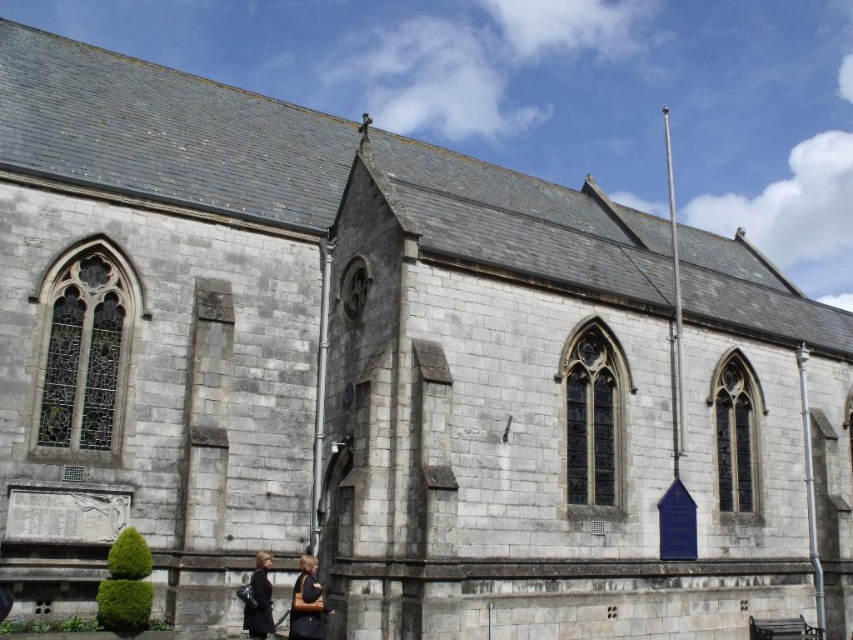
Does dark brown leather jacket at lower center appear on the right side of dark gray coat at lower center?

Correct, you'll find dark brown leather jacket at lower center to the right of dark gray coat at lower center.

Which is more to the left, dark brown leather jacket at lower center or dark gray coat at lower center?

From the viewer's perspective, dark gray coat at lower center appears more on the left side.

Is point (305, 612) positioned after point (268, 596)?

That is False.

I want to click on dark brown leather jacket at lower center, so click(306, 604).